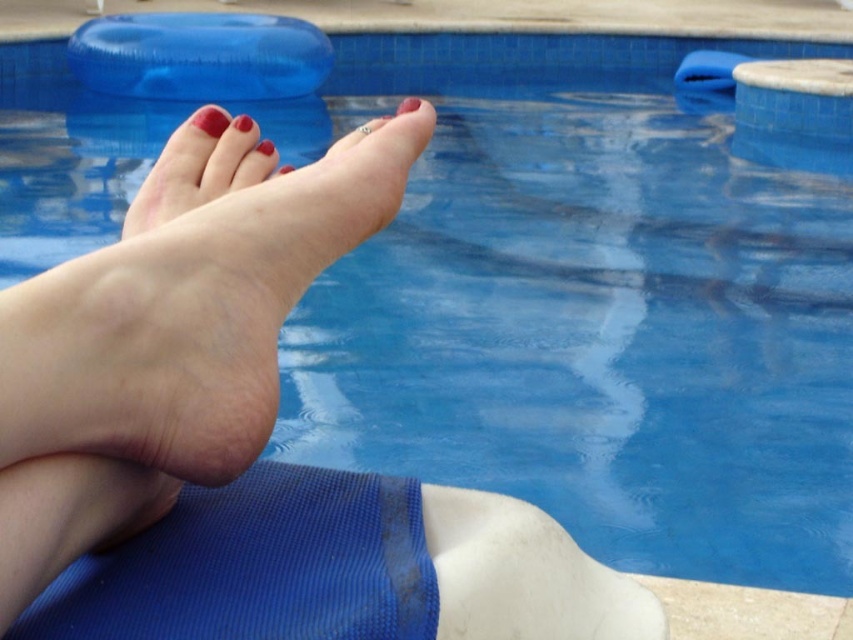
You are a photographer taking a close up shot of the scene. You want to focus on the smooth skin foot at center. Where should you aim your camera to capture it?

The smooth skin foot at center is located at the 2D coordinates point (x=189, y=316), so aim your camera there to capture it.

Looking at this image, you are a lifeguard observing the scene. You notice the smooth skin foot at center and the glossy red nail at center. Which object is positioned lower in the image?

The smooth skin foot at center is positioned below the glossy red nail at center, so the smooth skin foot at center is lower in the image.